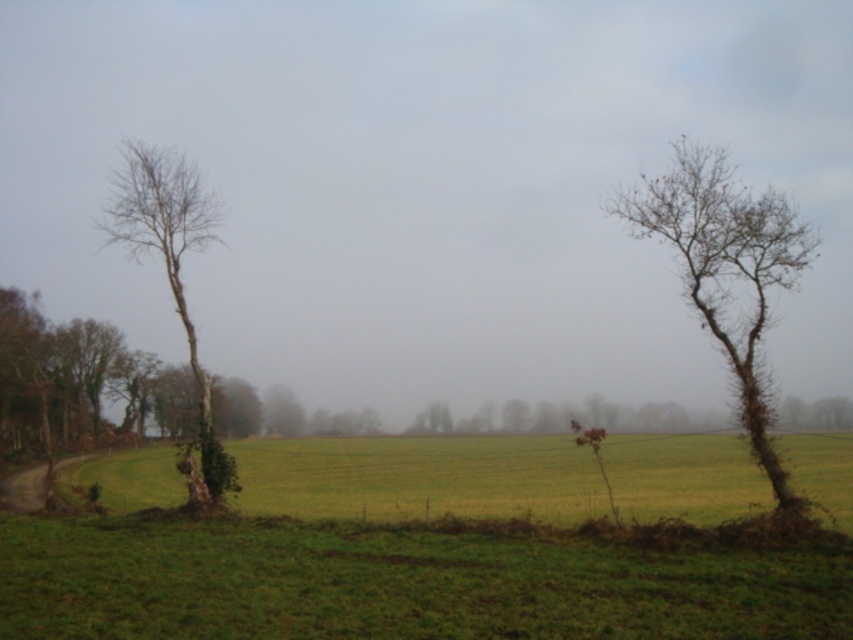
Which of these two, green grassy field at lower center or bare wood tree at left, stands shorter?

Standing shorter between the two is green grassy field at lower center.

Who is lower down, green grassy field at lower center or bare wood tree at left?

green grassy field at lower center is lower down.

What do you see at coordinates (402, 582) in the screenshot? I see `green grassy field at lower center` at bounding box center [402, 582].

You are a GUI agent. You are given a task and a screenshot of the screen. Output one action in this format:
    pyautogui.click(x=<x>, y=<y>)
    Task: Click on the green grassy field at lower center
    
    Given the screenshot: What is the action you would take?
    pyautogui.click(x=402, y=582)

Can you confirm if bare wood tree at right is positioned to the left of green matte tree at center?

Incorrect, bare wood tree at right is not on the left side of green matte tree at center.

Is bare wood tree at right smaller than green matte tree at center?

No, bare wood tree at right is not smaller than green matte tree at center.

Is point (639, 205) positioned behind point (280, 417)?

No, it is not.

Image resolution: width=853 pixels, height=640 pixels. I want to click on bare wood tree at right, so click(x=726, y=272).

Is green grassy field at lower center positioned in front of bare wood tree at right?

Yes.

Is green grassy field at lower center to the right of bare wood tree at right from the viewer's perspective?

No, green grassy field at lower center is not to the right of bare wood tree at right.

Who is more distant from viewer, [635,563] or [766,452]?

Point [766,452]

You are a GUI agent. You are given a task and a screenshot of the screen. Output one action in this format:
    pyautogui.click(x=<x>, y=<y>)
    Task: Click on the green grassy field at lower center
    The width and height of the screenshot is (853, 640).
    Given the screenshot: What is the action you would take?
    pyautogui.click(x=402, y=582)